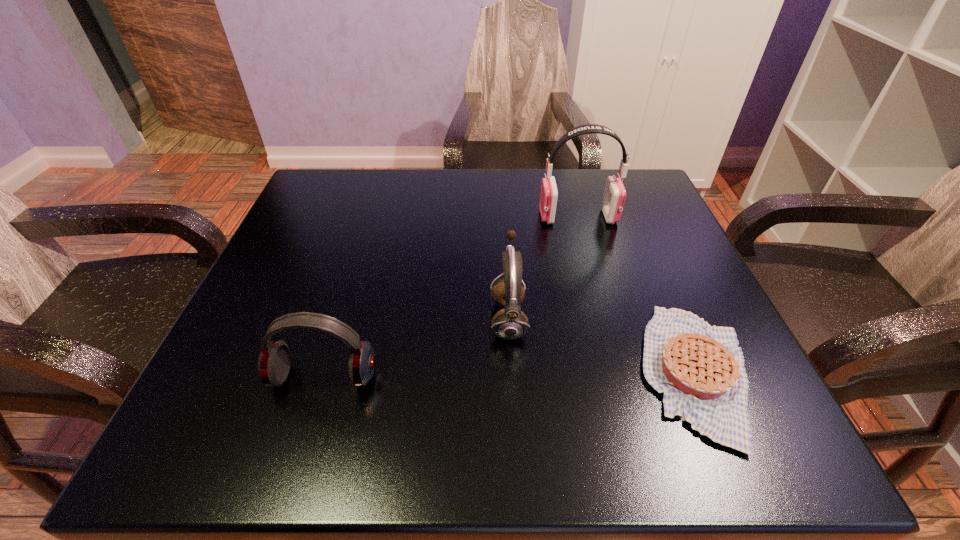
Identify the location of vacant area that lies between the farthest object and the shortest object. (637, 295).

Locate an element on the screen. vacant space in between the shortest object and the third shortest object is located at coordinates (603, 346).

Where is `free space between the pie and the second shortest earphone`? The width and height of the screenshot is (960, 540). free space between the pie and the second shortest earphone is located at coordinates (603, 346).

The width and height of the screenshot is (960, 540). Find the location of `vacant space in between the farthest object and the second farthest earphone`. vacant space in between the farthest object and the second farthest earphone is located at coordinates (543, 267).

Find the location of a particular element. The width and height of the screenshot is (960, 540). free space between the pie and the tallest earphone is located at coordinates (637, 295).

The image size is (960, 540). What are the coordinates of `unoccupied position between the farthest earphone and the pie` in the screenshot? It's located at (637, 295).

Image resolution: width=960 pixels, height=540 pixels. I want to click on vacant area that lies between the leftmost object and the farthest object, so click(x=450, y=297).

Identify the location of free spot between the tallest object and the pie. (637, 295).

Where is `blank region between the second farthest earphone and the second shortest object`? The image size is (960, 540). blank region between the second farthest earphone and the second shortest object is located at coordinates (416, 347).

The height and width of the screenshot is (540, 960). I want to click on object that is the third nearest to the farthest earphone, so click(x=273, y=365).